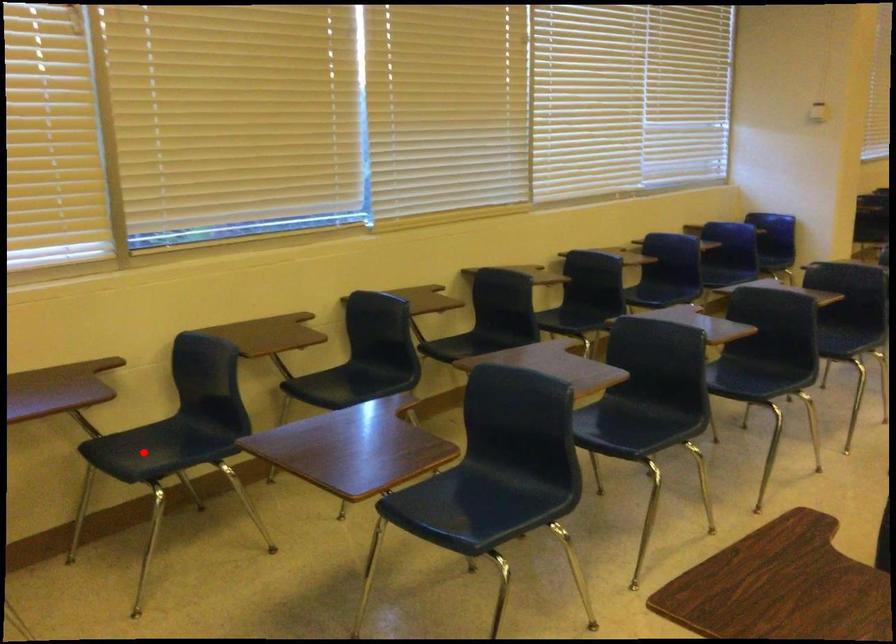
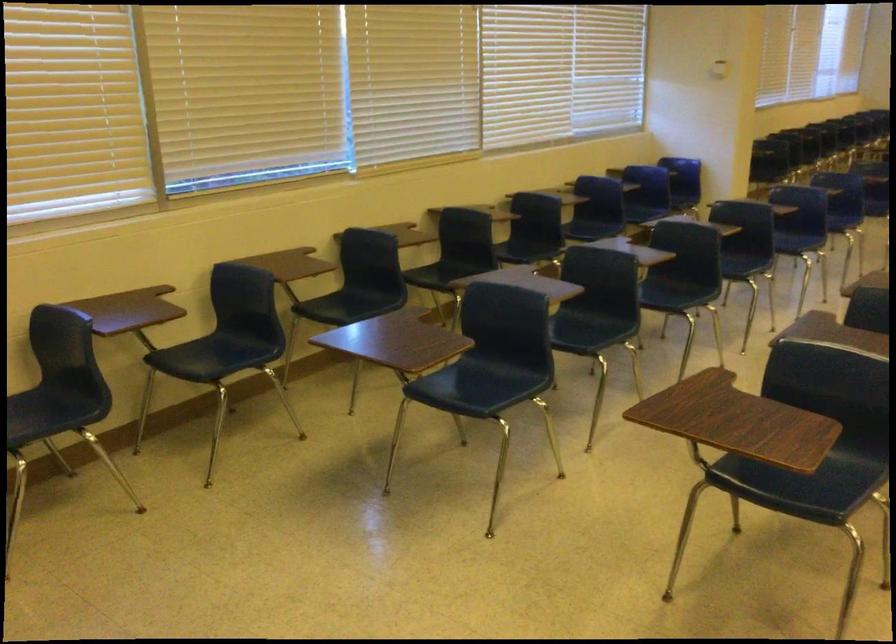
Question: I am providing you with two images of the same scene from different viewpoints. Image1 has a red point marked. In image2, the corresponding 3D location appears at what relative position? Reply with the corresponding letter.

Choices:
 (A) Closer
 (B) Farther

Answer: (B)